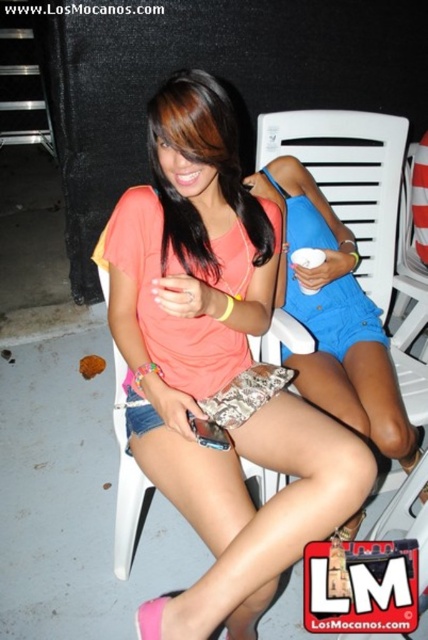
Can you confirm if matte coral tank top at center is taller than matte peach top at center?

Indeed, matte coral tank top at center has a greater height compared to matte peach top at center.

Which is in front, point (272, 536) or point (244, 198)?

Point (272, 536)

Which is in front, point (249, 563) or point (207, 147)?

Point (249, 563) is more forward.

Identify the location of matte coral tank top at center. pos(216,365).